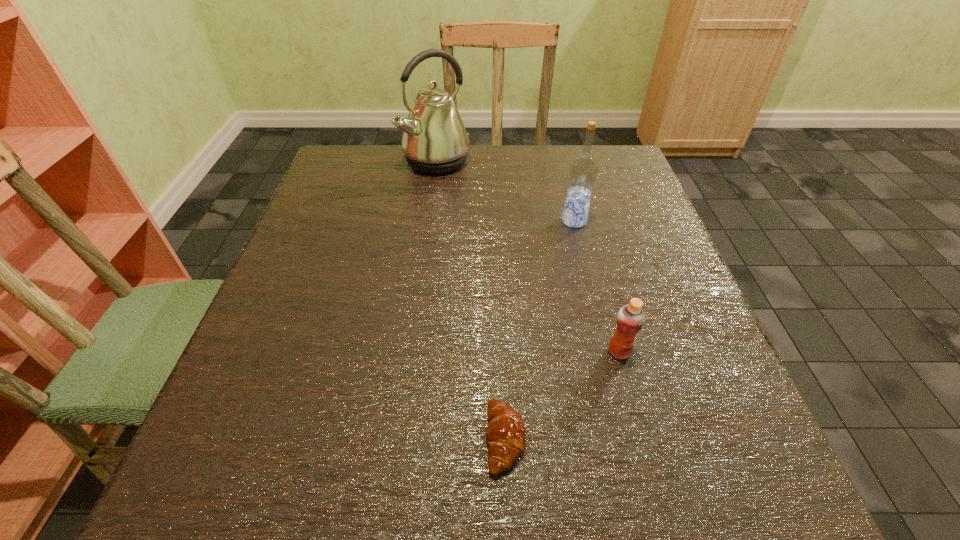
Locate an element on the screen. vacant area at the far right corner is located at coordinates (596, 157).

Locate an element on the screen. vacant space that is in between the second object from left to right and the leftmost object is located at coordinates (470, 300).

This screenshot has width=960, height=540. I want to click on vacant area between the third farthest object and the kettle, so click(x=528, y=256).

Find the location of a particular element. vacant space in between the vodka and the nearest object is located at coordinates (540, 330).

At what (x,y) coordinates should I click in order to perform the action: click on free spot between the crescent roll and the leftmost object. Please return your answer as a coordinate pair (x, y). Looking at the image, I should click on (470, 300).

Identify the location of vacant area between the farthest object and the orange juice. This screenshot has width=960, height=540. (528, 256).

At what (x,y) coordinates should I click in order to perform the action: click on free point between the crescent roll and the second farthest object. Please return your answer as a coordinate pair (x, y). Looking at the image, I should click on (540, 330).

Locate an element on the screen. vacant point located between the second nearest object and the second farthest object is located at coordinates (596, 286).

Image resolution: width=960 pixels, height=540 pixels. I want to click on free area in between the kettle and the third shortest object, so click(x=505, y=191).

I want to click on free space between the tallest object and the third object from right to left, so click(470, 300).